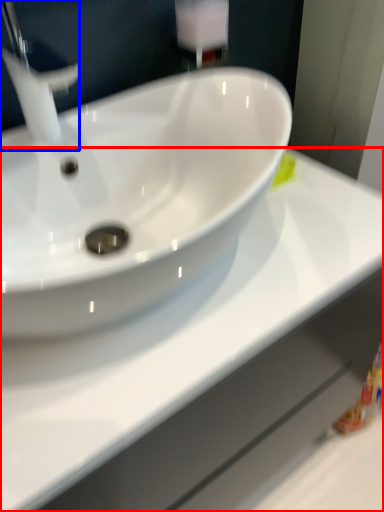
Question: Which of the following is the farthest to the observer, counter top (highlighted by a red box) or tap (highlighted by a blue box)?

Choices:
 (A) counter top
 (B) tap

Answer: (B)